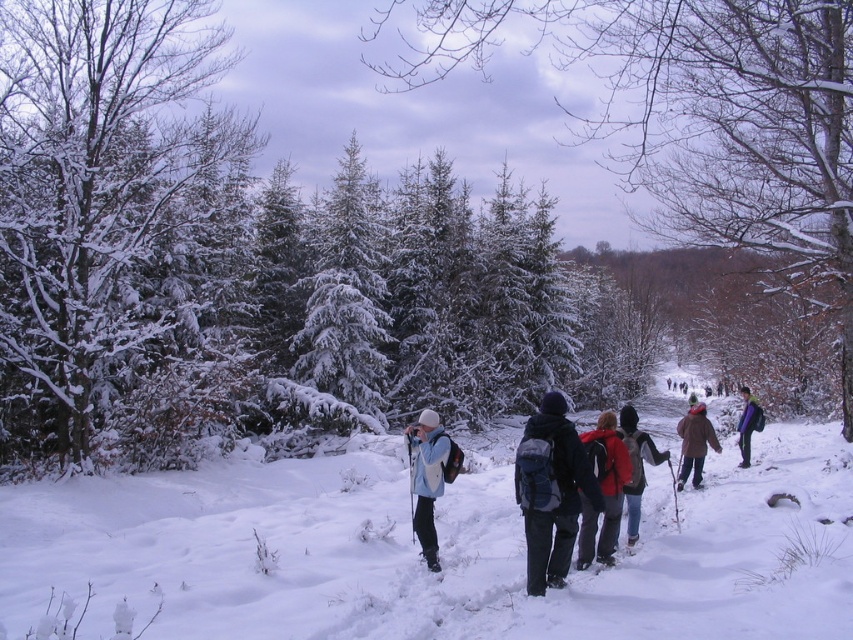
You are planning to take a winter hike and have both the red fleece jacket at center and the denim jacket at center. Based on the scene description, which jacket would be more appropriate to wear for warmth?

The denim jacket at center is thicker than the red fleece jacket at center, so it would provide better warmth for the winter hike.

You are standing at the edge of the forest path and want to take a photo of the white fluffy snow at center. Where should you position yourself to capture it in the frame?

To capture the white fluffy snow at center in your photo, position yourself so that the snow is centered at the coordinates approximately 0.861 along the horizontal axis and 0.516 along the vertical axis of the frame.